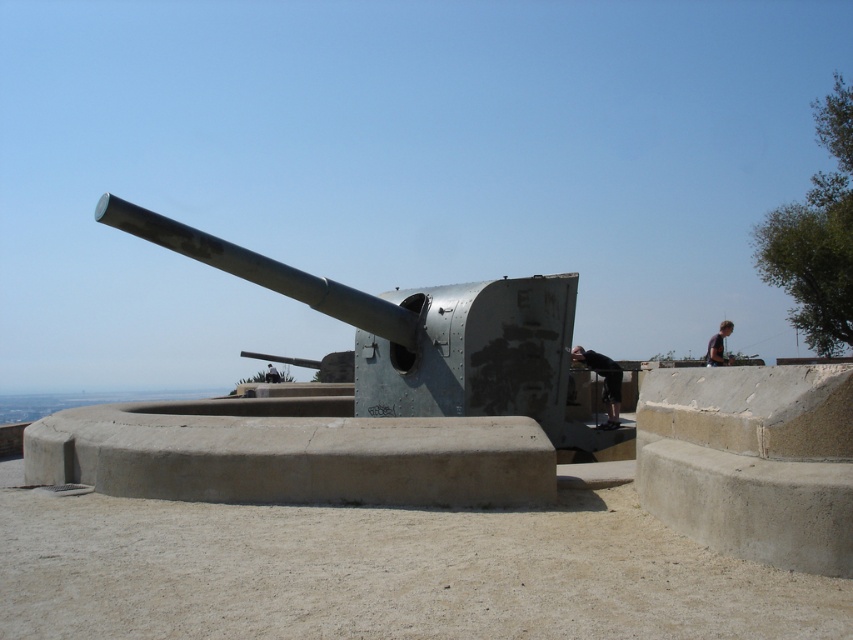
Looking at this image, you are a photographer standing at the base of the shiny metallic cannon at center. You want to take a picture that includes both the cannon and the dark blue shirt at upper right. Based on their sizes, which object should you move closer to in order to make them appear more balanced in the frame?

The shiny metallic cannon at center is smaller than the dark blue shirt at upper right. To balance their sizes in the frame, you should move closer to the shiny metallic cannon at center so it appears larger in the photo, while the dark blue shirt at upper right will appear slightly smaller from a farther distance.